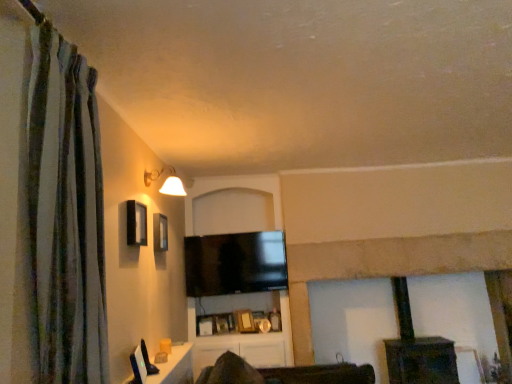
Question: From a real-world perspective, is dark brown wood fireplace at center beneath matte black window at upper left?

Choices:
 (A) yes
 (B) no

Answer: (A)

Question: From the image's perspective, is dark brown wood fireplace at center below matte black window at upper left?

Choices:
 (A) no
 (B) yes

Answer: (B)

Question: Can you confirm if dark brown wood fireplace at center is thinner than matte black window at upper left?

Choices:
 (A) yes
 (B) no

Answer: (B)

Question: Would you say matte black window at upper left is part of dark brown wood fireplace at center's contents?

Choices:
 (A) no
 (B) yes

Answer: (A)

Question: Is dark brown wood fireplace at center bigger than matte black window at upper left?

Choices:
 (A) no
 (B) yes

Answer: (B)

Question: Is dark brown wood fireplace at center positioned far away from matte black window at upper left?

Choices:
 (A) yes
 (B) no

Answer: (A)

Question: From a real-world perspective, is flat screen tv at center physically below white glossy table at lower left?

Choices:
 (A) no
 (B) yes

Answer: (A)

Question: Is flat screen tv at center bigger than white glossy table at lower left?

Choices:
 (A) yes
 (B) no

Answer: (A)

Question: Does flat screen tv at center have a smaller size compared to white glossy table at lower left?

Choices:
 (A) yes
 (B) no

Answer: (B)

Question: Can you confirm if flat screen tv at center is taller than white glossy table at lower left?

Choices:
 (A) no
 (B) yes

Answer: (B)

Question: From the image's perspective, is flat screen tv at center above white glossy table at lower left?

Choices:
 (A) yes
 (B) no

Answer: (A)

Question: From a real-world perspective, is flat screen tv at center over white glossy table at lower left?

Choices:
 (A) no
 (B) yes

Answer: (B)

Question: From a real-world perspective, is white glossy table at lower left positioned over flat screen tv at center based on gravity?

Choices:
 (A) yes
 (B) no

Answer: (B)